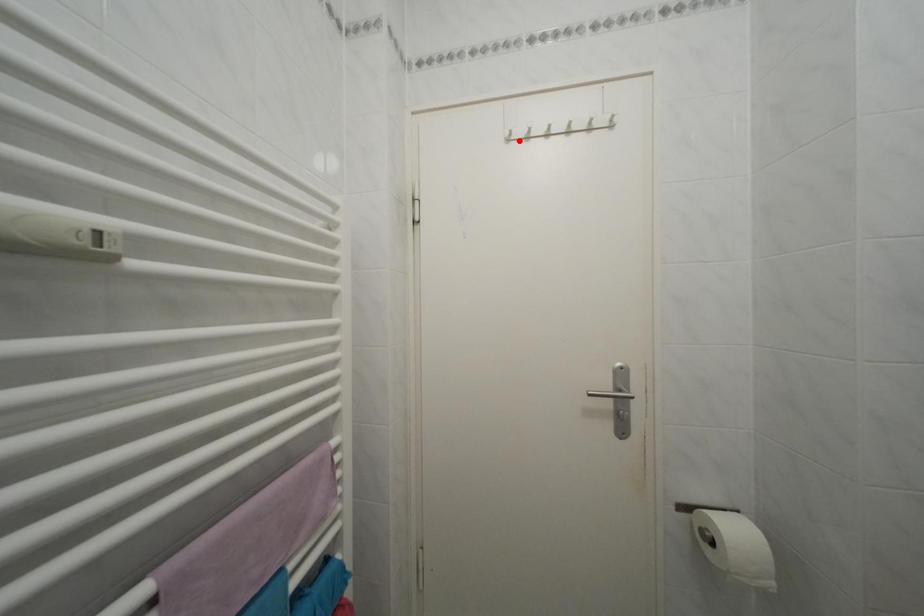
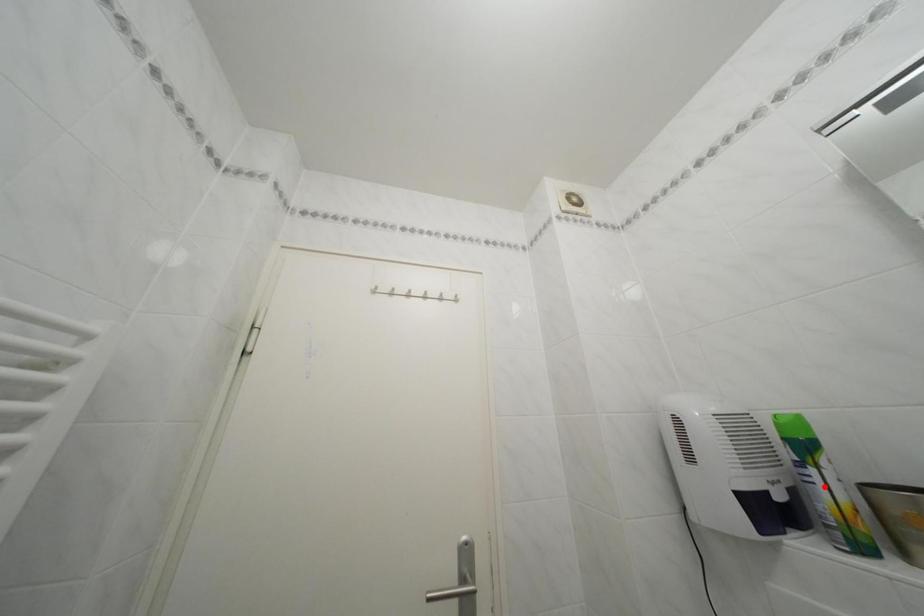
Looking at this image, I am providing you with two images of the same scene from different viewpoints. A red point is marked on the first image and another point is marked on the second image. Is the red point in image1 aligned with the point shown in image2?

No